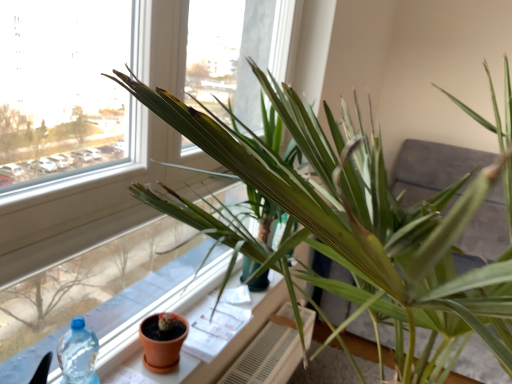
Locate an element on the screen. Image resolution: width=512 pixels, height=384 pixels. empty space that is ontop of terracotta clay pot at lower center (from a real-world perspective) is located at coordinates (220, 311).